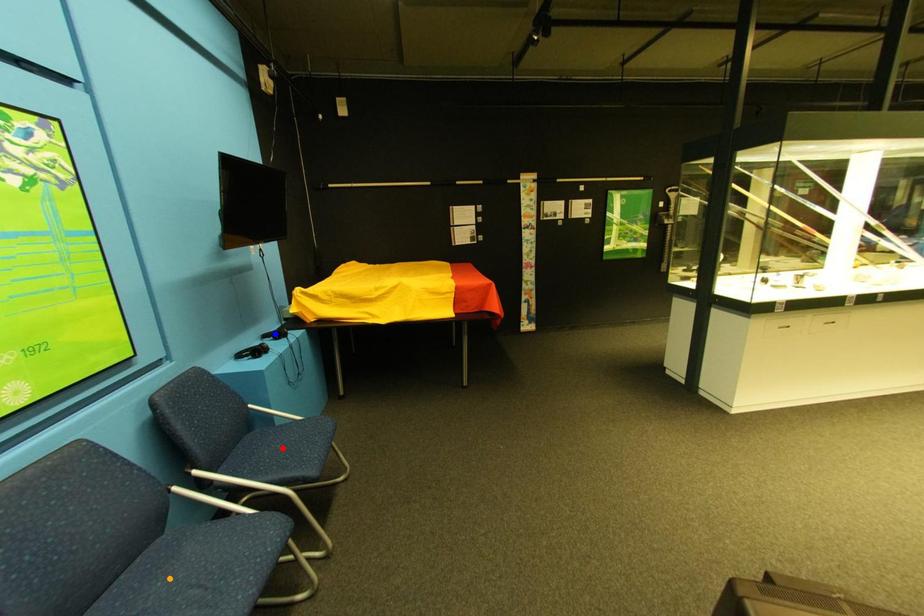
Order these from farthest to nearest:
orange point | blue point | red point

blue point, red point, orange point